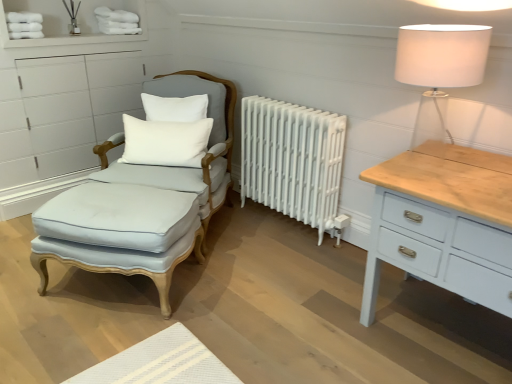
Where is `empty space that is to the right of light blue fabric footrest at left`? empty space that is to the right of light blue fabric footrest at left is located at coordinates (244, 284).